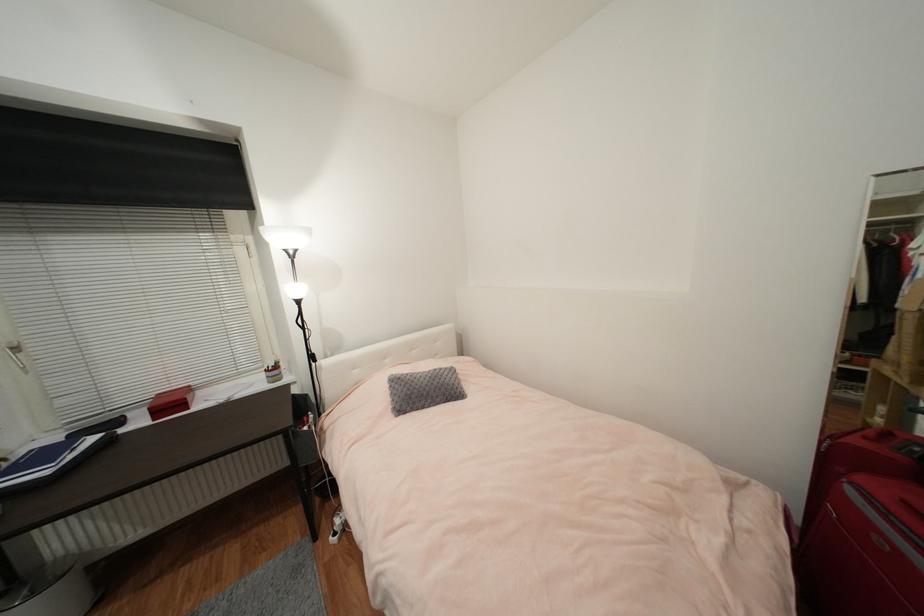
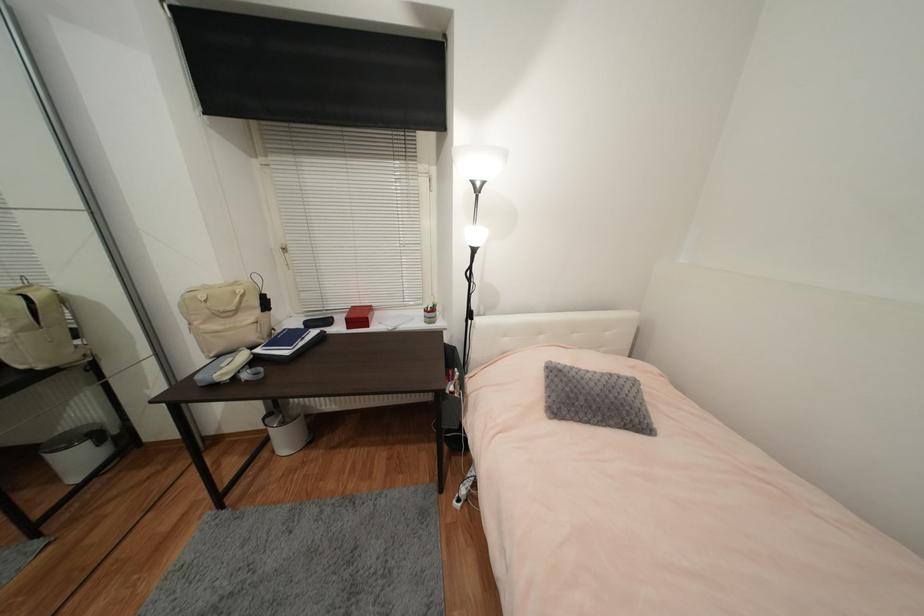
In the second image, find the point that corresponds to point (320, 363) in the first image.

(477, 320)